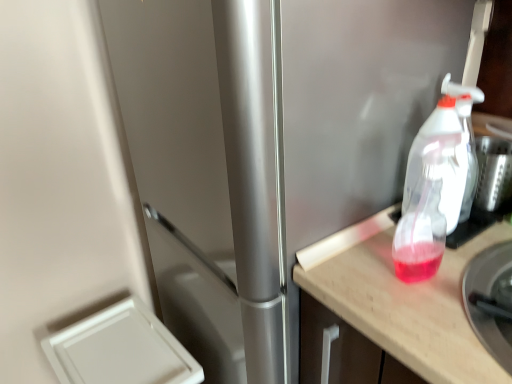
The width and height of the screenshot is (512, 384). Identify the location of space that is in front of translucent plastic spray bottle at right. (436, 324).